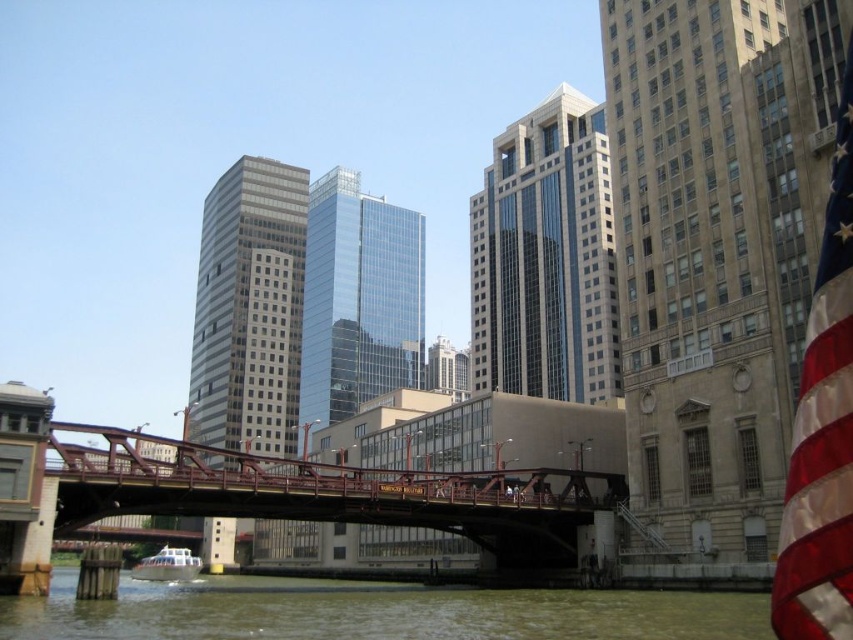
Question: Considering the real-world distances, which object is farthest from the greenish water at lower center?

Choices:
 (A) metallic red bridge at center
 (B) red fabric flag at right

Answer: (B)

Question: Which point is closer to the camera taking this photo?

Choices:
 (A) (548, 468)
 (B) (112, 604)
 (C) (163, 563)
 (D) (816, 344)

Answer: (D)

Question: Can you confirm if metallic red bridge at center is thinner than white matte boat at lower center?

Choices:
 (A) no
 (B) yes

Answer: (A)

Question: From the image, what is the correct spatial relationship of greenish water at lower center in relation to white matte boat at lower center?

Choices:
 (A) left
 (B) right

Answer: (B)

Question: Is greenish water at lower center to the right of red fabric flag at right from the viewer's perspective?

Choices:
 (A) no
 (B) yes

Answer: (A)

Question: Which is nearer to the red fabric flag at right?

Choices:
 (A) white matte boat at lower center
 (B) metallic red bridge at center
 (C) greenish water at lower center

Answer: (C)